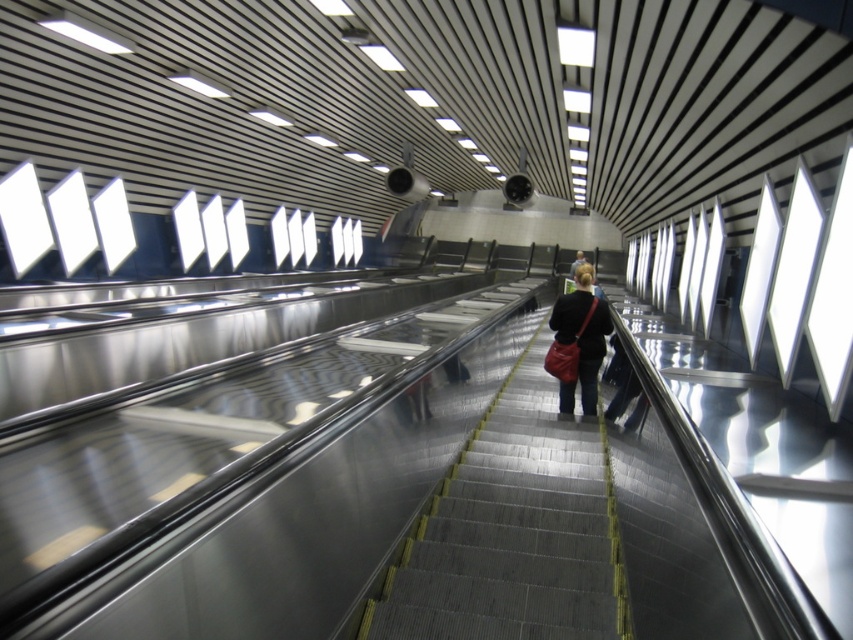
You are standing at point 0.5, 0.5 in the transportation hub. Where are the metallic gray stairs at center located relative to your position?

The metallic gray stairs at center are located at point (511, 531), which is northeast of your current position at (426, 320).

You are standing at the entrance of the escalator system in the transportation hub. You need to reach the metallic gray stairs at center. Which direction should you move relative to the escalator steps that are moving upwards?

Since the metallic gray stairs at center is located at point coordinates, you should move towards the center of the escalator system to reach them, as they are positioned centrally in the space.

Consider the image. You are standing on the platform of the escalator and see the metallic gray stairs at center and the black leather jacket at center. Which object is closer to you?

The metallic gray stairs at center is closer to the viewer than the black leather jacket at center.